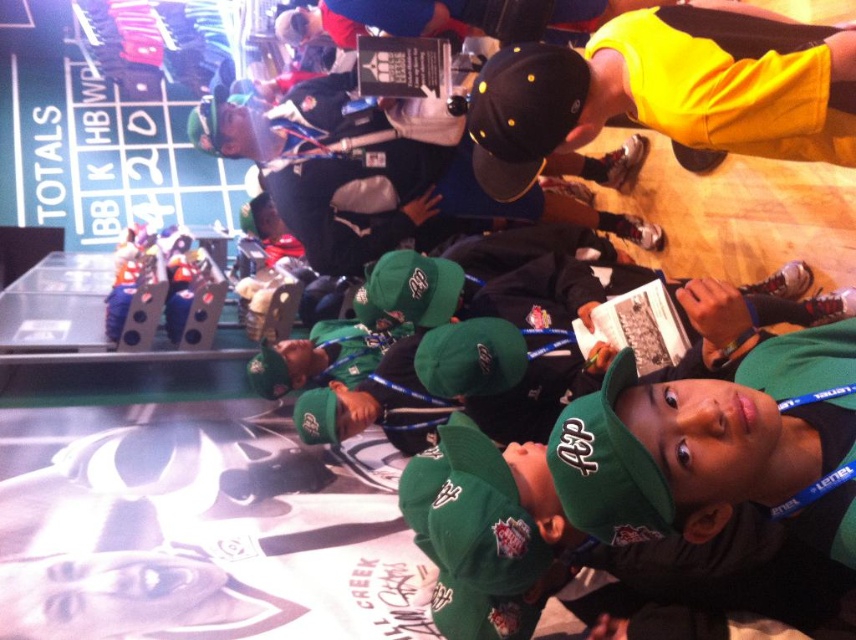
Question: Is black matte baseball cap at upper center bigger than green fabric baseball cap at center?

Choices:
 (A) yes
 (B) no

Answer: (A)

Question: Considering the relative positions of green fabric cap at center and yellow matte cap at upper right in the image provided, where is green fabric cap at center located with respect to yellow matte cap at upper right?

Choices:
 (A) below
 (B) above

Answer: (A)

Question: Which point is closer to the camera?

Choices:
 (A) yellow matte cap at upper right
 (B) green fabric baseball cap at center
 (C) black matte baseball cap at upper center
 (D) green fabric cap at center

Answer: (D)

Question: Which object is positioned closest to the green fabric cap at center?

Choices:
 (A) green fabric baseball cap at center
 (B) black matte baseball cap at upper center

Answer: (B)

Question: Which object appears farthest from the camera in this image?

Choices:
 (A) green fabric cap at center
 (B) yellow matte cap at upper right
 (C) black matte baseball cap at upper center
 (D) green fabric baseball cap at center

Answer: (D)

Question: From the image, what is the correct spatial relationship of yellow matte cap at upper right in relation to black matte baseball cap at upper center?

Choices:
 (A) above
 (B) below

Answer: (A)